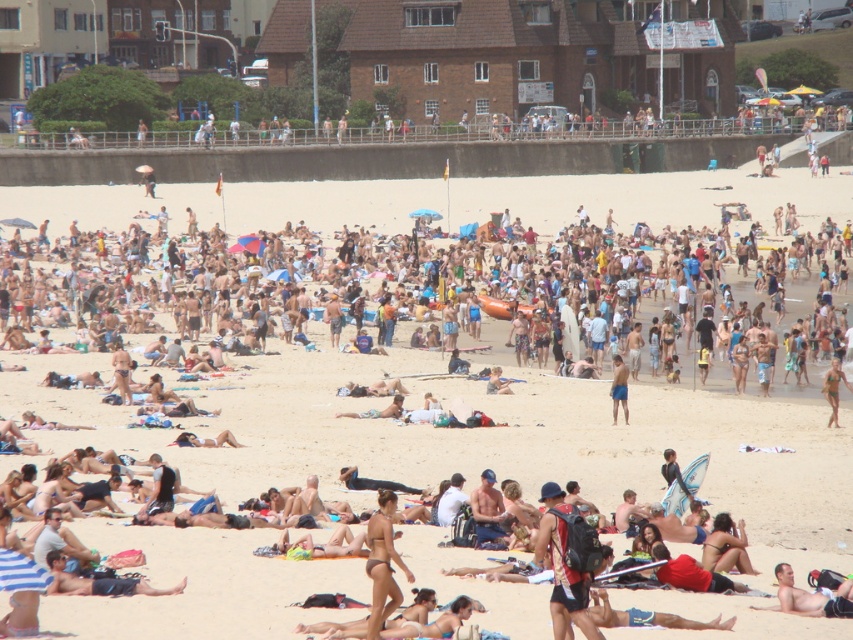
Is matte black bikini at center behind tan skin person at lower left?

No, matte black bikini at center is closer to the viewer.

Who is more forward, (370, 576) or (180, 586)?

Point (370, 576)

Locate an element on the screen. The width and height of the screenshot is (853, 640). matte black bikini at center is located at coordinates (381, 563).

Does beige sand crowd at center have a greater width compared to red fabric swimsuit at center?

Yes.

Can you confirm if beige sand crowd at center is taller than red fabric swimsuit at center?

Yes, beige sand crowd at center is taller than red fabric swimsuit at center.

The height and width of the screenshot is (640, 853). What do you see at coordinates (407, 294) in the screenshot?
I see `beige sand crowd at center` at bounding box center [407, 294].

At what (x,y) coordinates should I click in order to perform the action: click on beige sand crowd at center. Please return your answer as a coordinate pair (x, y). Looking at the image, I should click on (407, 294).

Is red fabric swimsuit at center to the left of tan skin person at lower left from the viewer's perspective?

Incorrect, red fabric swimsuit at center is not on the left side of tan skin person at lower left.

The image size is (853, 640). What do you see at coordinates (561, 568) in the screenshot? I see `red fabric swimsuit at center` at bounding box center [561, 568].

Between point (556, 522) and point (146, 588), which one is positioned in front?

Point (146, 588)

Image resolution: width=853 pixels, height=640 pixels. I want to click on red fabric swimsuit at center, so click(x=561, y=568).